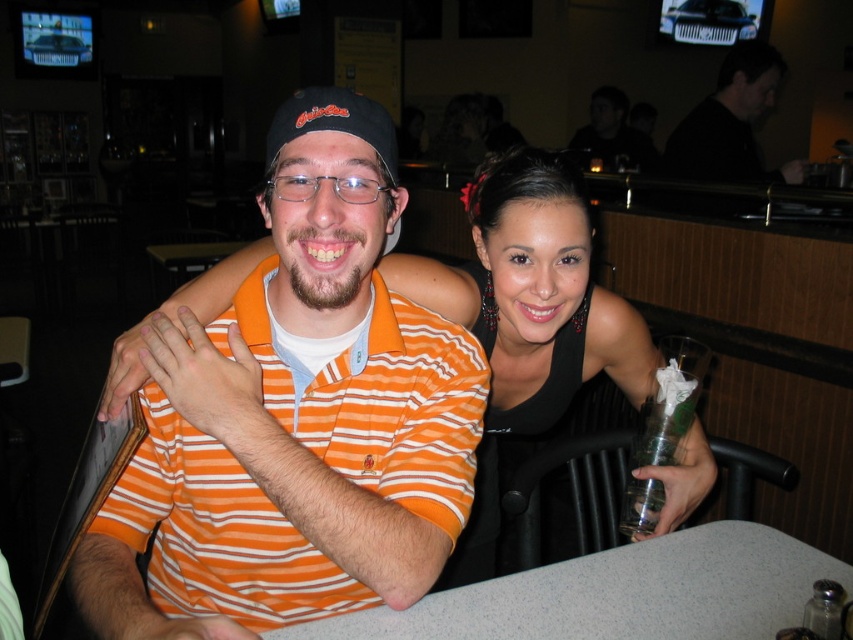
You are a photographer adjusting your camera settings to focus on two points in the image. The first point is at coordinates point (439, 632) and the second is at point (834, 586). Which point should you focus on first if you want to capture the closest object to the camera?

You should focus on point (439, 632) first because it is closer to the camera than point (834, 586).